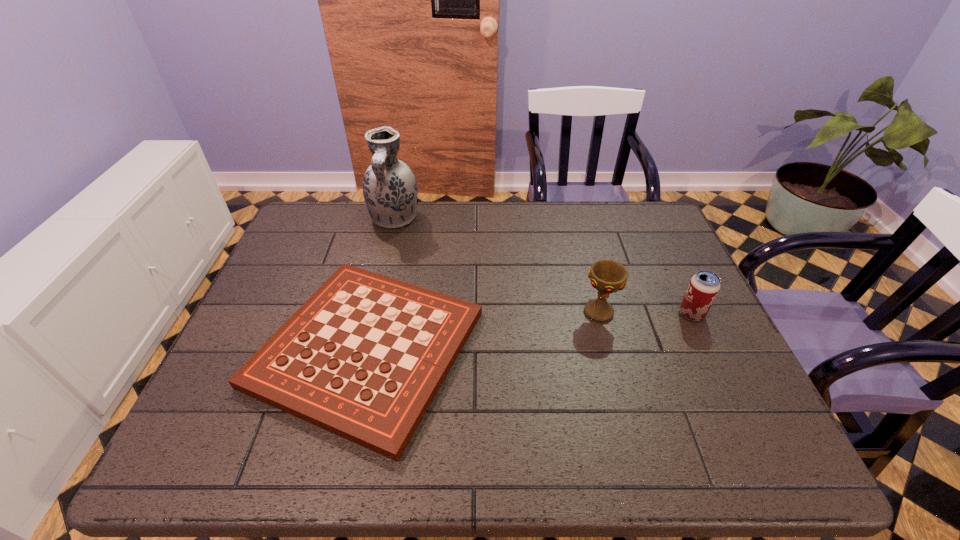
You are a GUI agent. You are given a task and a screenshot of the screen. Output one action in this format:
    pyautogui.click(x=<x>, y=<y>)
    Task: Click on the free space between the rightmost object and the chalice
    The width and height of the screenshot is (960, 540).
    Given the screenshot: What is the action you would take?
    pyautogui.click(x=645, y=313)

You are a GUI agent. You are given a task and a screenshot of the screen. Output one action in this format:
    pyautogui.click(x=<x>, y=<y>)
    Task: Click on the free point between the gameboard and the second object from right to left
    
    Given the screenshot: What is the action you would take?
    pyautogui.click(x=483, y=330)

Identify the location of unoccupied area between the rightmost object and the second object from right to left. (645, 313).

The height and width of the screenshot is (540, 960). What are the coordinates of `vacant space that's between the shortest object and the chalice` in the screenshot? It's located at (483, 330).

Identify the location of vacant area that lies between the chalice and the farthest object. (497, 265).

The image size is (960, 540). What are the coordinates of `free space between the chalice and the beer can` in the screenshot? It's located at (645, 313).

This screenshot has height=540, width=960. What are the coordinates of `free space between the gameboard and the third object from left to right` in the screenshot? It's located at pyautogui.click(x=483, y=330).

Locate an element on the screen. This screenshot has height=540, width=960. free spot between the chalice and the vase is located at coordinates (497, 265).

Where is `vacant area that lies between the tallest object and the rightmost object`? Image resolution: width=960 pixels, height=540 pixels. vacant area that lies between the tallest object and the rightmost object is located at coordinates (542, 266).

The height and width of the screenshot is (540, 960). I want to click on the closest object to the beer can, so click(607, 276).